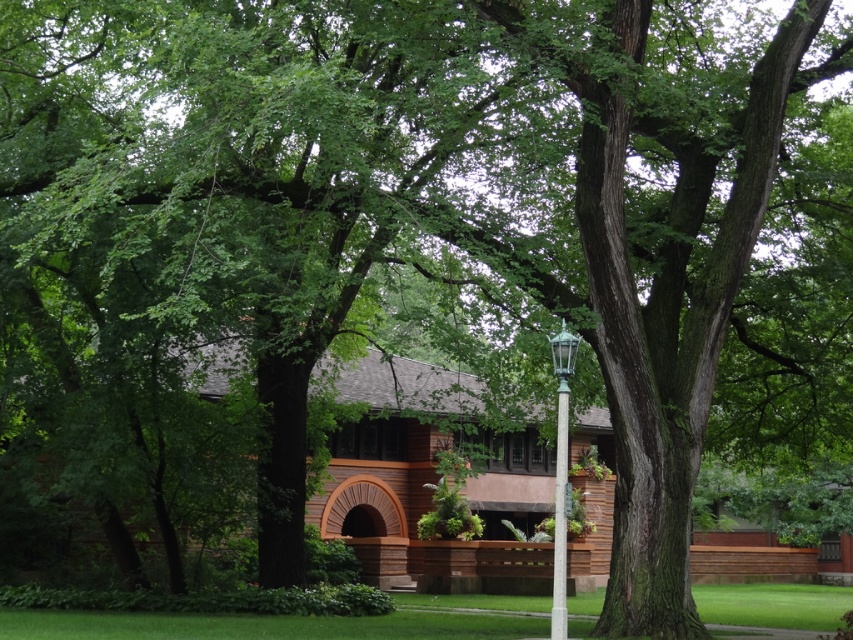
Consider the image. You are planning to place a new bench in the garden. The bench requires a space wider than the green glass lamp post at center. Can the area where the green grass at lower center is located accommodate the bench?

The green grass at lower center is wider than the green glass lamp post at center, so the area where the green grass at lower center is located can accommodate the bench since its width is sufficient.

Consider the image. You are standing in the middle of the lawn and see the green glass lamp post at center and the green glass pole at center. Which object is closer to your right side?

The green glass pole at center is closer to your right side because the green glass lamp post at center is to the left of it.